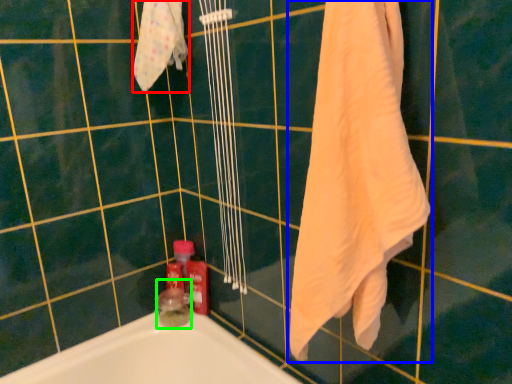
Question: Estimate the real-world distances between objects in this image. Which object is farther from bath towel (highlighted by a red box), towel (highlighted by a blue box) or toiletry (highlighted by a green box)?

Choices:
 (A) towel
 (B) toiletry

Answer: (B)